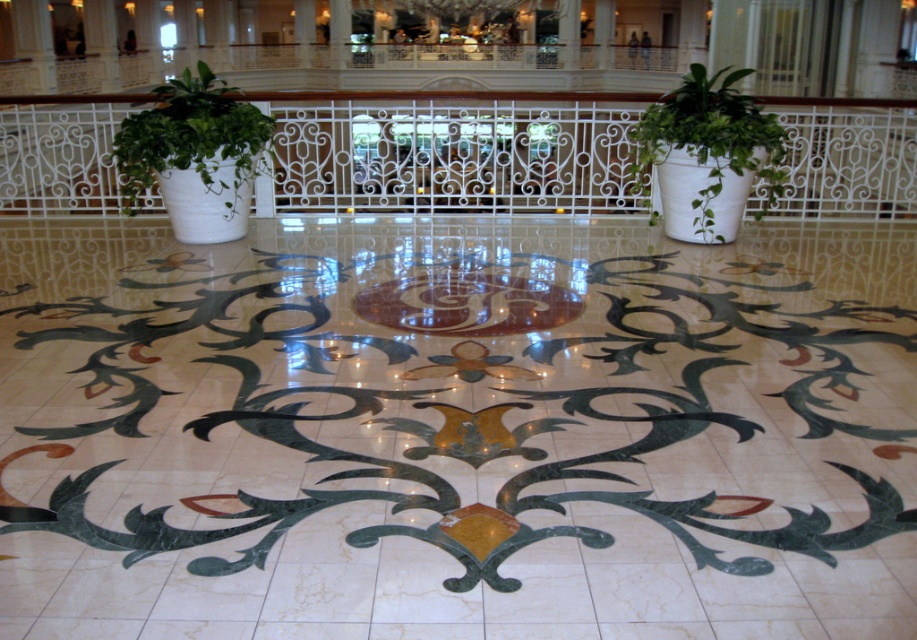
In the scene shown: You are a guest at the hotel and want to place a small decorative item on the floor between the white wrought iron at center and the green matte plant at center. Based on their positions, which object should you place it closer to?

The white wrought iron at center is below the green matte plant at center, so placing the item closer to the white wrought iron at center would ensure it is on the floor between them.

You are standing in the grand hotel lobby and see a point marked at coordinates (455, 154). What object is this point located on?

The point at coordinates (455, 154) is located on the white wrought iron at center.

You are a hotel guest carrying a large suitcase and want to place it near the white wrought iron at center and the green matte plant at center. Which object should you place the suitcase closer to if you want to maximize the available space around it?

You should place the suitcase closer to the white wrought iron at center because it occupies less space than the green matte plant at center, leaving more room around it.